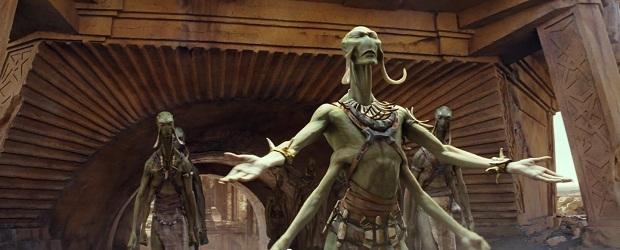
I want to click on window, so click(557, 138).